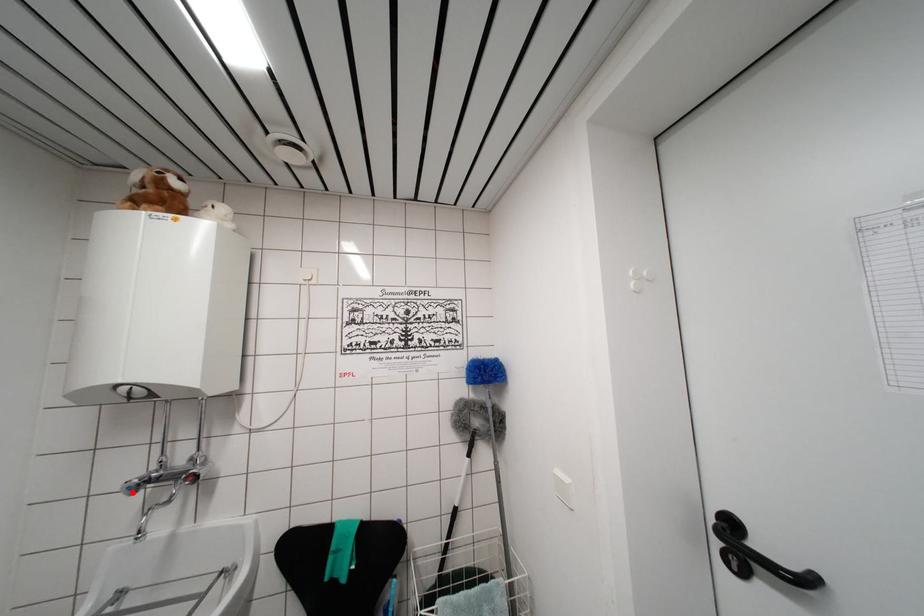
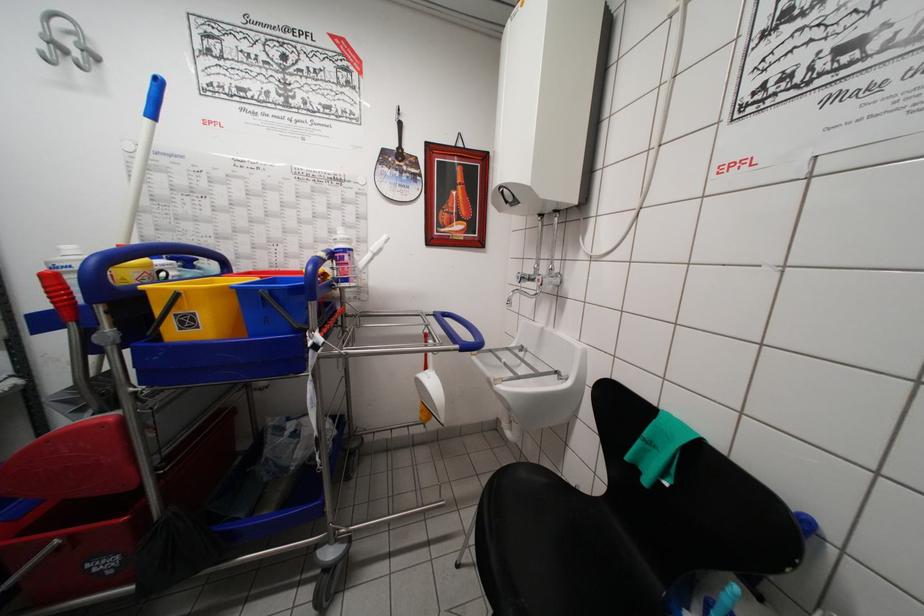
The point at the highlighted location is marked in the first image. Where is the corresponding point in the second image?

(521, 282)